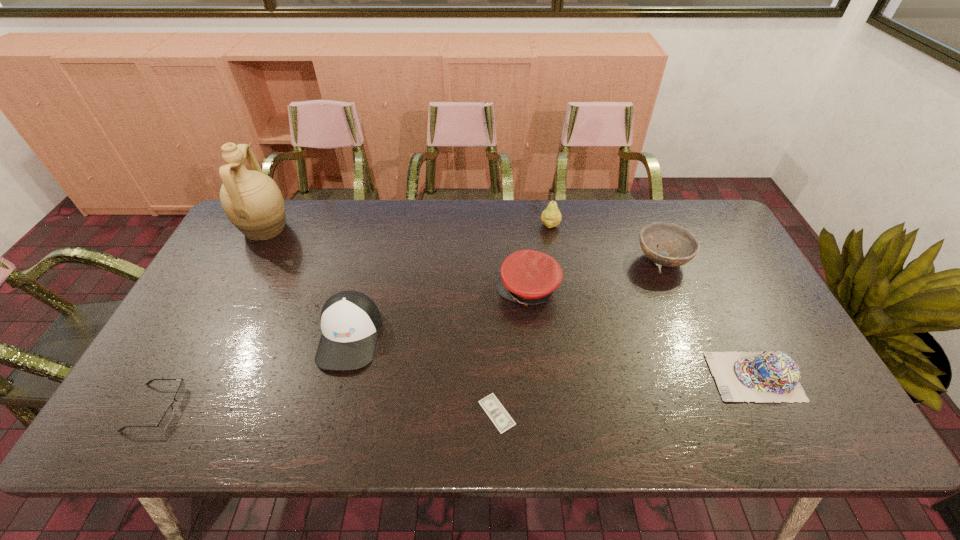
Identify the location of cap that is at the right edge. The width and height of the screenshot is (960, 540). (768, 376).

Find the location of a particular element. This screenshot has width=960, height=540. object positioned at the far left corner is located at coordinates (252, 201).

Locate an element on the screen. This screenshot has width=960, height=540. object at the near left corner is located at coordinates (168, 415).

What are the coordinates of `object situated at the far right corner` in the screenshot? It's located at (683, 247).

The width and height of the screenshot is (960, 540). In the image, there is a desktop. Identify the location of vacant space at the far edge. (397, 215).

Identify the location of vacant space at the near edge. (478, 441).

Identify the location of vacant space at the left edge. Image resolution: width=960 pixels, height=540 pixels. (155, 367).

Identify the location of vacant space at the right edge of the desktop. This screenshot has height=540, width=960. (747, 315).

The height and width of the screenshot is (540, 960). I want to click on free region at the far left corner of the desktop, so click(240, 239).

Locate an element on the screen. This screenshot has height=540, width=960. vacant region between the pear and the bowl is located at coordinates (606, 242).